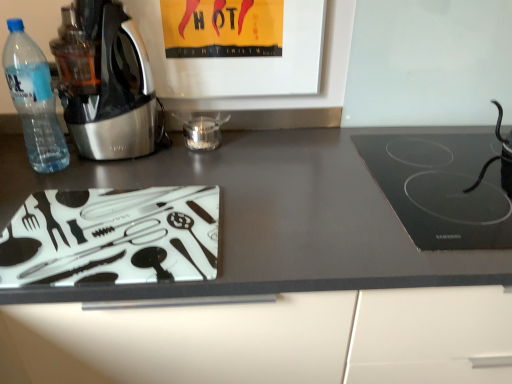
Question: Considering the positions of black rubber cable at right, which ranks as the first appliance in right-to-left order, and matte glass cutting board at lower left in the image, is black rubber cable at right, which ranks as the first appliance in right-to-left order, wider or thinner than matte glass cutting board at lower left?

Choices:
 (A) thin
 (B) wide

Answer: (A)

Question: Relative to matte glass cutting board at lower left, is black rubber cable at right, which is counted as the 2th appliance, starting from the left, in front or behind?

Choices:
 (A) behind
 (B) front

Answer: (A)

Question: Estimate the real-world distances between objects in this image. Which object is farther from the matte glass cutting board at lower left?

Choices:
 (A) transparent glass jar at center, arranged as the first appliance when viewed from the left
 (B) black glass cooktop at right
 (C) metallic stainless steel kettle at left
 (D) transparent plastic bottle at left
 (E) black rubber cable at right, which is counted as the 2th appliance, starting from the left

Answer: (E)

Question: Estimate the real-world distances between objects in this image. Which object is farther from the black rubber cable at right, which ranks as the first appliance in right-to-left order?

Choices:
 (A) matte glass cutting board at lower left
 (B) transparent glass jar at center, arranged as the first appliance when viewed from the left
 (C) black glass cooktop at right
 (D) metallic stainless steel kettle at left
 (E) transparent plastic bottle at left

Answer: (E)